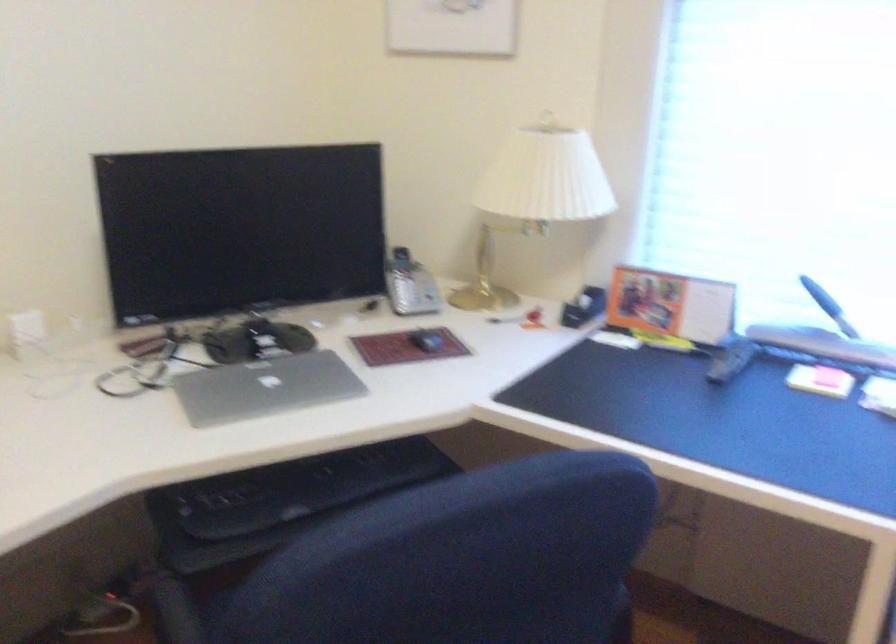
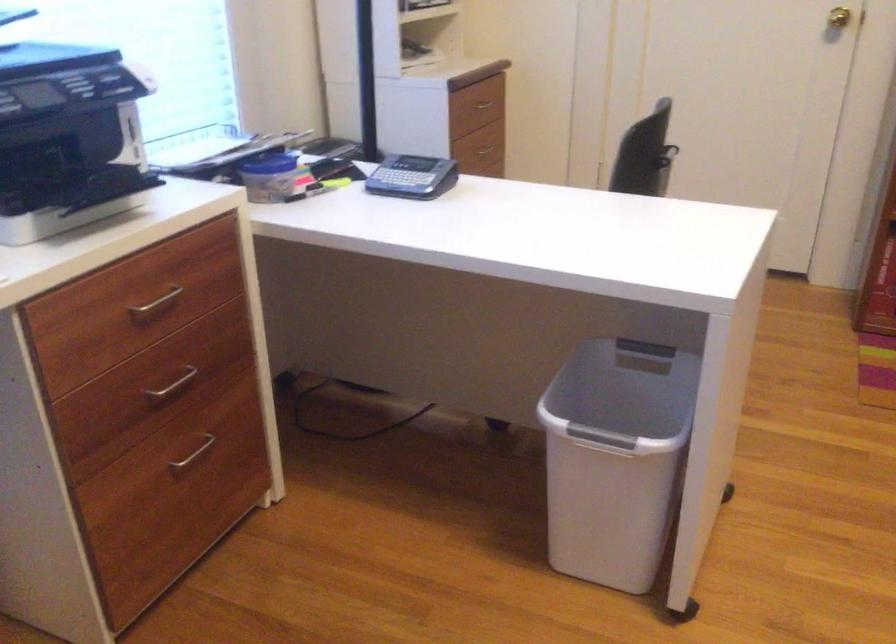
Based on the continuous images, in which direction is the camera rotating?

The camera's rotation is toward right-down.